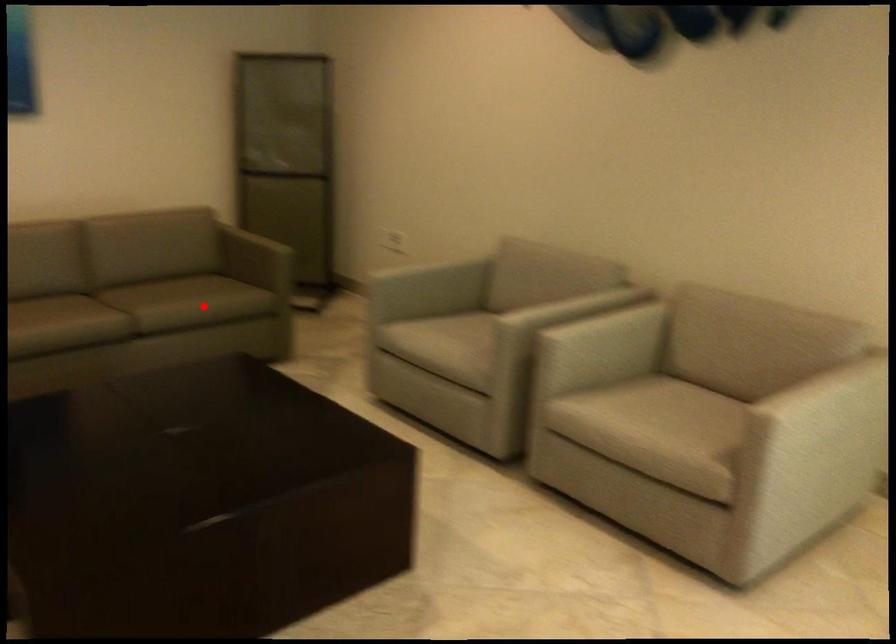
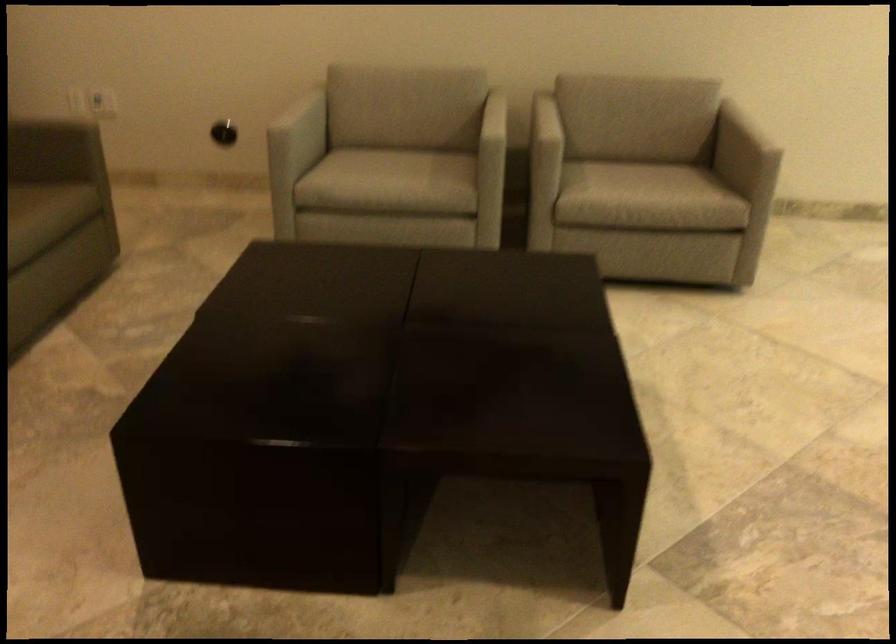
Question: I am providing you with two images of the same scene from different viewpoints. Given a red point in image1, look at the same physical point in image2. Is it:

Choices:
 (A) Closer to the viewpoint
 (B) Farther from the viewpoint

Answer: (A)